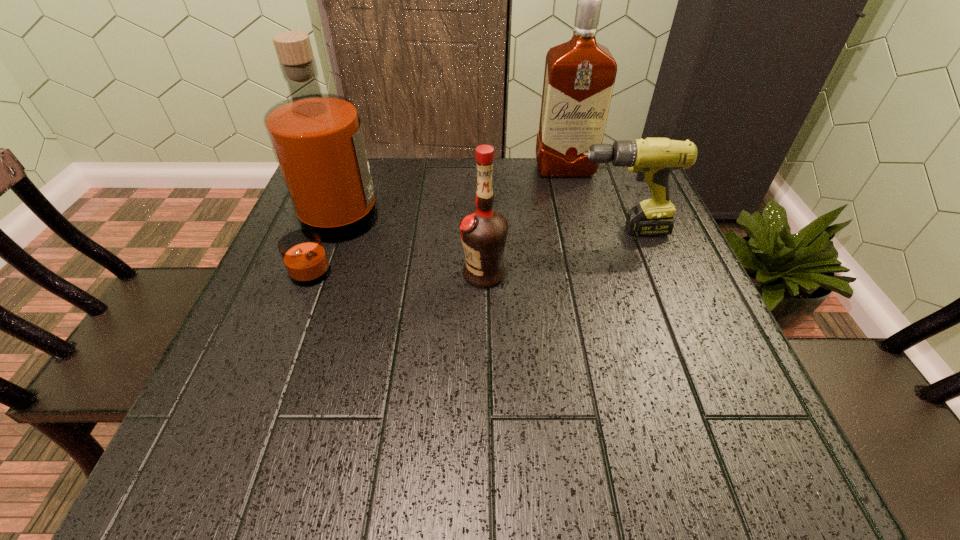
Find the location of a particular element. the farthest object is located at coordinates click(x=579, y=77).

Locate an element on the screen. The image size is (960, 540). the rightmost liquor is located at coordinates (579, 77).

Identify the location of the leftmost liquor. (317, 138).

This screenshot has height=540, width=960. In order to click on the third object from right to left in this screenshot , I will do `click(484, 232)`.

Where is `the shortest liquor`? the shortest liquor is located at coordinates (484, 232).

This screenshot has height=540, width=960. I want to click on the shortest object, so click(x=653, y=159).

Find the location of `free location located on the front label of the farthest liquor`. free location located on the front label of the farthest liquor is located at coordinates (587, 257).

Where is `vacant space located on the front label of the leftmost object`? This screenshot has height=540, width=960. vacant space located on the front label of the leftmost object is located at coordinates (466, 237).

You are a GUI agent. You are given a task and a screenshot of the screen. Output one action in this format:
    pyautogui.click(x=<x>, y=<y>)
    Task: Click on the vacant space situated 0.300m on the front and back of the second shortest object
    This screenshot has width=960, height=540.
    Given the screenshot: What is the action you would take?
    pyautogui.click(x=318, y=273)

Locate an element on the screen. free space located 0.310m on the front and back of the second shortest object is located at coordinates (313, 273).